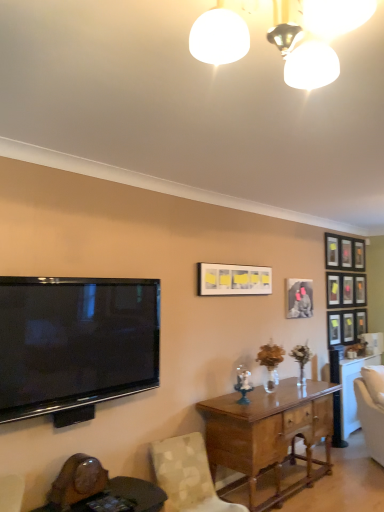
What are the coordinates of `matte black picture frame at upper right, the fourth picture frame viewed from the front` in the screenshot? It's located at (333, 289).

What is the approximate width of flat screen tv at left?

flat screen tv at left is 6.03 inches in width.

What do you see at coordinates (269, 434) in the screenshot?
I see `light brown wood desk at center` at bounding box center [269, 434].

Where is `light brown wood desk at center`? light brown wood desk at center is located at coordinates (269, 434).

What do you see at coordinates (125, 496) in the screenshot? Image resolution: width=384 pixels, height=512 pixels. I see `wooden round table at lower left` at bounding box center [125, 496].

You are a GUI agent. You are given a task and a screenshot of the screen. Output one action in this format:
    pyautogui.click(x=<x>, y=<y>)
    Task: Click on the white glossy light fixture at upper center
    The width and height of the screenshot is (384, 512).
    Given the screenshot: What is the action you would take?
    pyautogui.click(x=314, y=36)

From the image's perspective, which object appears higher, metallic silver picture frame at upper right, which ranks as the 6th picture frame in left-to-right order, or wooden round table at lower left?

metallic silver picture frame at upper right, which ranks as the 6th picture frame in left-to-right order, appears higher in the image.

Is metallic silver picture frame at upper right, which appears as the first picture frame when viewed from the back, located outside wooden round table at lower left?

Absolutely, metallic silver picture frame at upper right, which appears as the first picture frame when viewed from the back, is external to wooden round table at lower left.

How distant is metallic silver picture frame at upper right, which is counted as the sixth picture frame, starting from the front, from wooden round table at lower left?

metallic silver picture frame at upper right, which is counted as the sixth picture frame, starting from the front, is 4.06 meters from wooden round table at lower left.

In the scene shown: Is metallic silver picture frame at upper right, which ranks as the 6th picture frame in left-to-right order, to the right of wooden round table at lower left from the viewer's perspective?

Correct, you'll find metallic silver picture frame at upper right, which ranks as the 6th picture frame in left-to-right order, to the right of wooden round table at lower left.

Which object is positioned more to the left, white glossy light fixture at upper center or wooden picture frame at center-right, which is the third picture frame in front-to-back order?

From the viewer's perspective, white glossy light fixture at upper center appears more on the left side.

You are a GUI agent. You are given a task and a screenshot of the screen. Output one action in this format:
    pyautogui.click(x=<x>, y=<y>)
    Task: Click on the light fixture located above the wooden picture frame at center-right, which is the 4th picture frame from back to front (from the image's perspective)
    The image size is (384, 512).
    Given the screenshot: What is the action you would take?
    pyautogui.click(x=314, y=36)

From the image's perspective, is white glossy light fixture at upper center under wooden picture frame at center-right, which is the 4th picture frame from back to front?

Actually, white glossy light fixture at upper center appears above wooden picture frame at center-right, which is the 4th picture frame from back to front, in the image.

Which is nearer, (337, 282) or (211, 404)?

The point (211, 404) is in front.

Considering the positions of objects matte black picture frame at upper right, the fourth picture frame viewed from the front, and light brown wood desk at center in the image provided, who is more to the left, matte black picture frame at upper right, the fourth picture frame viewed from the front, or light brown wood desk at center?

From the viewer's perspective, light brown wood desk at center appears more on the left side.

Considering the sizes of objects matte black picture frame at upper right, which is counted as the 3th picture frame, starting from the back, and light brown wood desk at center in the image provided, who is wider, matte black picture frame at upper right, which is counted as the 3th picture frame, starting from the back, or light brown wood desk at center?

With larger width is light brown wood desk at center.

Consider the image. Does matte black picture frame at upper right, which is counted as the 3th picture frame, starting from the back, have a smaller size compared to light brown wood desk at center?

Indeed, matte black picture frame at upper right, which is counted as the 3th picture frame, starting from the back, has a smaller size compared to light brown wood desk at center.

Can you confirm if matte black picture frame at upper right, acting as the 5th picture frame starting from the front, is bigger than matte black picture frame at upper right, which appears as the 2th picture frame when viewed from the front?

No.

Who is more distant, matte black picture frame at upper right, acting as the 5th picture frame starting from the front, or matte black picture frame at upper right, the fifth picture frame from the right?

matte black picture frame at upper right, acting as the 5th picture frame starting from the front, is more distant.

Would you consider matte black picture frame at upper right, acting as the 5th picture frame starting from the front, to be distant from matte black picture frame at upper right, the 2th picture frame viewed from the left?

matte black picture frame at upper right, acting as the 5th picture frame starting from the front, is near matte black picture frame at upper right, the 2th picture frame viewed from the left, not far away.

Is wooden picture frame at center-right, which is the third picture frame in front-to-back order, taller than light brown wood desk at center?

In fact, wooden picture frame at center-right, which is the third picture frame in front-to-back order, may be shorter than light brown wood desk at center.

Is wooden picture frame at center-right, marked as the third picture frame in a left-to-right arrangement, wider than light brown wood desk at center?

In fact, wooden picture frame at center-right, marked as the third picture frame in a left-to-right arrangement, might be narrower than light brown wood desk at center.

There is a light brown wood desk at center. Identify the location of light fixture above it (from a real-world perspective). The image size is (384, 512). (314, 36).

Is white glossy light fixture at upper center further to the viewer compared to light brown wood desk at center?

No, white glossy light fixture at upper center is in front of light brown wood desk at center.

In the scene shown: From a real-world perspective, which is physically above, white glossy light fixture at upper center or light brown wood desk at center?

white glossy light fixture at upper center is physically above.

Can you confirm if white glossy light fixture at upper center is positioned to the left of light brown wood desk at center?

Yes, white glossy light fixture at upper center is to the left of light brown wood desk at center.

Is wooden round table at lower left with patterned fabric chair at lower left?

No, wooden round table at lower left is not touching patterned fabric chair at lower left.

In the scene shown: From a real-world perspective, is wooden round table at lower left positioned over patterned fabric chair at lower left based on gravity?

No, from a real-world perspective, wooden round table at lower left is not above patterned fabric chair at lower left.

Based on their positions, is wooden round table at lower left located to the left or right of patterned fabric chair at lower left?

From the image, it's evident that wooden round table at lower left is to the left of patterned fabric chair at lower left.

Is wooden round table at lower left oriented towards patterned fabric chair at lower left?

No.

At what (x,y) coordinates should I click in order to perform the action: click on the 6th picture frame behind the wooden round table at lower left, starting your count from the anchor. Please return your answer as a coordinate pair (x, y). The width and height of the screenshot is (384, 512). Looking at the image, I should click on (346, 253).

At what (x,y) coordinates should I click in order to perform the action: click on light fixture above the wooden picture frame at center-right, marked as the third picture frame in a left-to-right arrangement (from a real-world perspective). Please return your answer as a coordinate pair (x, y). The width and height of the screenshot is (384, 512). Looking at the image, I should click on (314, 36).

When comparing their distances from light brown wood desk at center, does patterned fabric chair at lower left or wooden picture frame at center-right, which is the 4th picture frame from back to front, seem closer?

Among the two, patterned fabric chair at lower left is located nearer to light brown wood desk at center.

Considering their positions, is matte white picture frame at center, the 1th picture frame viewed from the front, positioned further to metallic silver picture frame at upper right, which is counted as the sixth picture frame, starting from the front, than matte black picture frame at upper right, marked as the fifth picture frame in a left-to-right arrangement?

matte white picture frame at center, the 1th picture frame viewed from the front, is positioned further to the anchor metallic silver picture frame at upper right, which is counted as the sixth picture frame, starting from the front.

Which object lies further to the anchor point metallic silver picture frame at upper right, which appears as the first picture frame when viewed from the back, matte white picture frame at center, the 6th picture frame viewed from the right, or matte black picture frame at upper right, which is counted as the 3th picture frame, starting from the back?

matte white picture frame at center, the 6th picture frame viewed from the right, lies further to metallic silver picture frame at upper right, which appears as the first picture frame when viewed from the back, than the other object.

Estimate the real-world distances between objects in this image. Which object is further from metallic silver picture frame at upper right, which appears as the first picture frame when viewed from the back, matte black picture frame at upper right, arranged as the second picture frame when viewed from the right, or light brown wood desk at center?

light brown wood desk at center is further to metallic silver picture frame at upper right, which appears as the first picture frame when viewed from the back.

When comparing their distances from matte white picture frame at center, the 1th picture frame viewed from the front, does matte black picture frame at upper right, marked as the fifth picture frame in a left-to-right arrangement, or patterned fabric chair at lower left seem closer?

patterned fabric chair at lower left.

Which object lies further to the anchor point matte black picture frame at upper right, which is counted as the 3th picture frame, starting from the back, matte white picture frame at center, positioned as the 1th picture frame in left-to-right order, or matte black picture frame at upper right, which appears as the 2th picture frame when viewed from the front?

matte white picture frame at center, positioned as the 1th picture frame in left-to-right order.

Looking at the image, which one is located closer to wooden round table at lower left, matte white picture frame at center, the 6th picture frame viewed from the right, or light brown wood desk at center?

light brown wood desk at center is positioned closer to the anchor wooden round table at lower left.

Which object lies nearer to the anchor point wooden picture frame at center-right, marked as the third picture frame in a left-to-right arrangement, matte black picture frame at upper right, the 5th picture frame in the back-to-front sequence, or matte black picture frame at upper right, acting as the 5th picture frame starting from the front?

The object closer to wooden picture frame at center-right, marked as the third picture frame in a left-to-right arrangement, is matte black picture frame at upper right, acting as the 5th picture frame starting from the front.

At what (x,y) coordinates should I click in order to perform the action: click on desk between flat screen tv at left and matte black picture frame at upper right, which is counted as the 3th picture frame, starting from the back, from front to back. Please return your answer as a coordinate pair (x, y). The width and height of the screenshot is (384, 512). Looking at the image, I should click on (269, 434).

You are a GUI agent. You are given a task and a screenshot of the screen. Output one action in this format:
    pyautogui.click(x=<x>, y=<y>)
    Task: Click on the television positioned between white glossy light fixture at upper center and matte black picture frame at upper right, the fifth picture frame from the right, from near to far
    
    Given the screenshot: What is the action you would take?
    pyautogui.click(x=75, y=344)

The width and height of the screenshot is (384, 512). I want to click on round table between white glossy light fixture at upper center and light brown wood desk at center in the vertical direction, so click(125, 496).

You are a GUI agent. You are given a task and a screenshot of the screen. Output one action in this format:
    pyautogui.click(x=<x>, y=<y>)
    Task: Click on the picture frame located between light brown wood desk at center and matte black picture frame at upper right, which appears as the 2th picture frame when viewed from the front, in the depth direction
    This screenshot has width=384, height=512.
    Given the screenshot: What is the action you would take?
    pyautogui.click(x=233, y=280)